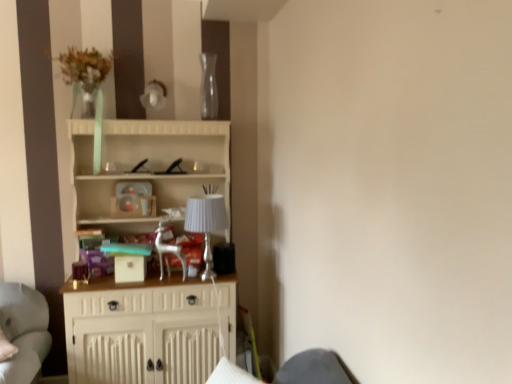
Question: Is point (204, 248) positioned closer to the camera than point (153, 182)?

Choices:
 (A) farther
 (B) closer

Answer: (B)

Question: In the image, is silver metallic lamp at center positioned in front of or behind white wood cupboard at center?

Choices:
 (A) front
 (B) behind

Answer: (B)

Question: In the image, is silver metallic lamp at center on the left side or the right side of white wood cupboard at center?

Choices:
 (A) right
 (B) left

Answer: (A)

Question: Considering the relative positions of white wood cupboard at center and silver metallic lamp at center in the image provided, is white wood cupboard at center to the left or to the right of silver metallic lamp at center?

Choices:
 (A) right
 (B) left

Answer: (B)

Question: From the image's perspective, is white wood cupboard at center positioned above or below silver metallic lamp at center?

Choices:
 (A) above
 (B) below

Answer: (B)

Question: Which is correct: white wood cupboard at center is inside silver metallic lamp at center, or outside of it?

Choices:
 (A) inside
 (B) outside

Answer: (B)

Question: Considering the positions of point (81, 152) and point (207, 278), is point (81, 152) closer or farther from the camera than point (207, 278)?

Choices:
 (A) farther
 (B) closer

Answer: (A)